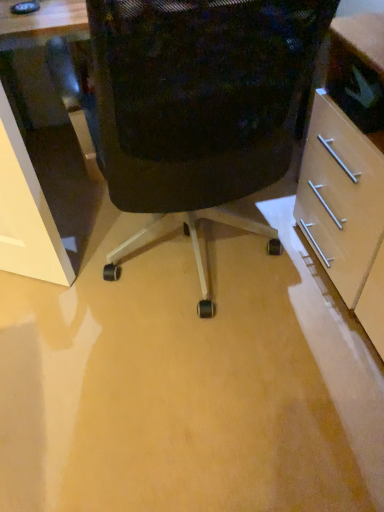
Question: Should I look upward or downward to see black mesh chair at center?

Choices:
 (A) up
 (B) down

Answer: (A)